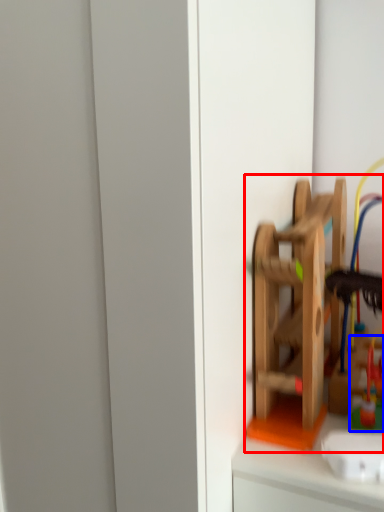
Question: Which object is further to the camera taking this photo, toy (highlighted by a red box) or toy (highlighted by a blue box)?

Choices:
 (A) toy
 (B) toy

Answer: (B)